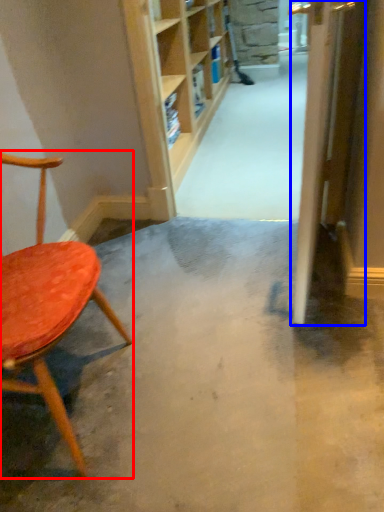
Question: Among these objects, which one is nearest to the camera, chair (highlighted by a red box) or door (highlighted by a blue box)?

Choices:
 (A) chair
 (B) door

Answer: (A)